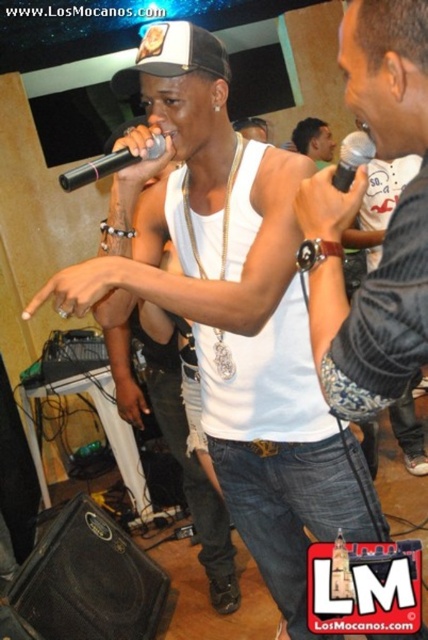
Question: Among these objects, which one is farthest from the camera?

Choices:
 (A) black matte microphone at center
 (B) matte black shirt at center

Answer: (B)

Question: Does black matte microphone at center have a smaller size compared to matte black shirt at center?

Choices:
 (A) yes
 (B) no

Answer: (A)

Question: Among these objects, which one is nearest to the camera?

Choices:
 (A) matte black shirt at center
 (B) denim jacket at right

Answer: (B)

Question: Where is denim jacket at right located in relation to black matte microphone at center in the image?

Choices:
 (A) left
 (B) right

Answer: (B)

Question: Which object is positioned closest to the black matte microphone at center?

Choices:
 (A) black metallic microphone at center
 (B) matte black shirt at center

Answer: (A)

Question: From the image, what is the correct spatial relationship of denim jacket at right in relation to black metallic microphone at center?

Choices:
 (A) left
 (B) right

Answer: (B)